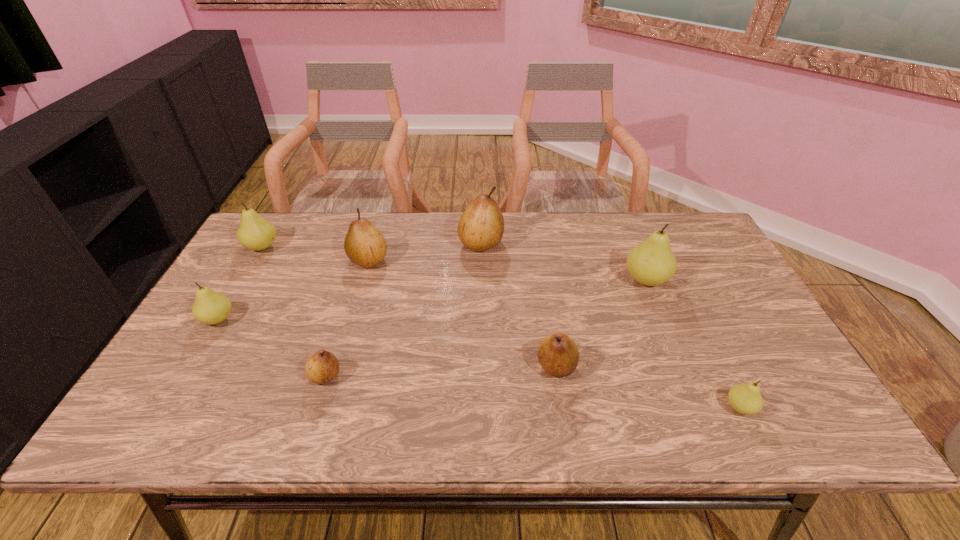
Find the location of `object at the near edge`. object at the near edge is located at coordinates (746, 399).

Identify the location of object located in the right edge section of the desktop. This screenshot has height=540, width=960. (746, 399).

Identify the location of object that is at the far left corner. The height and width of the screenshot is (540, 960). (255, 233).

Locate an element on the screen. The image size is (960, 540). object that is at the near right corner is located at coordinates (746, 399).

Where is `vacant point at the far edge`? The image size is (960, 540). vacant point at the far edge is located at coordinates (378, 219).

Where is `free region at the near edge of the desktop`? The image size is (960, 540). free region at the near edge of the desktop is located at coordinates (482, 411).

The image size is (960, 540). In the image, there is a desktop. In order to click on vacant space at the left edge in this screenshot , I will do `click(237, 303)`.

In the image, there is a desktop. Where is `free space at the right edge`? free space at the right edge is located at coordinates (721, 266).

In the image, there is a desktop. Where is `free space at the near left corner`? The height and width of the screenshot is (540, 960). free space at the near left corner is located at coordinates (156, 431).

Locate an element on the screen. This screenshot has width=960, height=540. vacant space at the far right corner of the desktop is located at coordinates (652, 213).